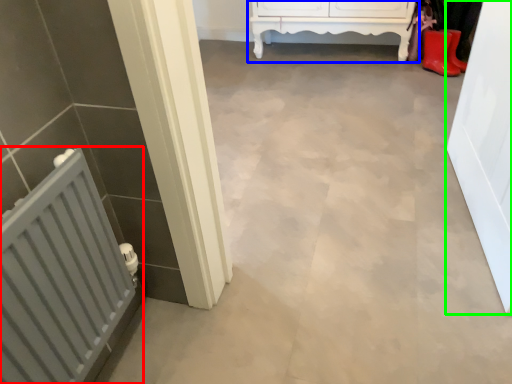
Question: Considering the real-world distances, which object is farthest from radiator (highlighted by a red box)? furniture (highlighted by a blue box) or door (highlighted by a green box)?

Choices:
 (A) furniture
 (B) door

Answer: (A)